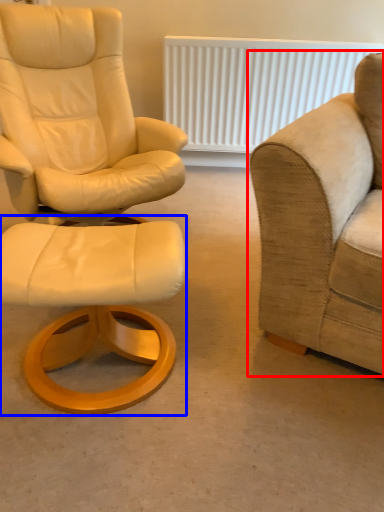
Question: Which point is closer to the camera, studio couch (highlighted by a red box) or stool (highlighted by a blue box)?

Choices:
 (A) studio couch
 (B) stool

Answer: (A)